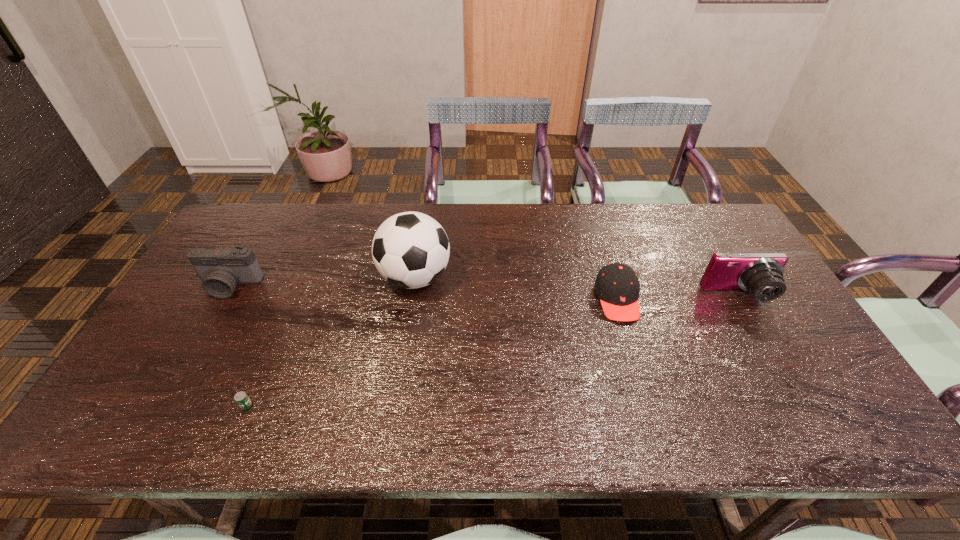
You are a GUI agent. You are given a task and a screenshot of the screen. Output one action in this format:
    pyautogui.click(x=<x>, y=<y>)
    Task: Click on the third object from left to right
    
    Given the screenshot: What is the action you would take?
    pyautogui.click(x=410, y=250)

At what (x,y) coordinates should I click in order to perform the action: click on soccer ball. Please return your answer as a coordinate pair (x, y). The width and height of the screenshot is (960, 540). Looking at the image, I should click on (410, 250).

Where is `the rightmost object`? the rightmost object is located at coordinates (761, 274).

Identify the location of the left camera. (221, 269).

What are the coordinates of `the second shortest object` in the screenshot? It's located at (617, 285).

Locate an element on the screen. the second object from right to left is located at coordinates (617, 285).

Identify the location of the nearest object. This screenshot has width=960, height=540. (241, 398).

At what (x,y) coordinates should I click in order to perform the action: click on beer can. Please return your answer as a coordinate pair (x, y). Looking at the image, I should click on (241, 398).

Where is `vacant space located 0.240m on the right of the third object from right to left`? The image size is (960, 540). vacant space located 0.240m on the right of the third object from right to left is located at coordinates (531, 278).

What are the coordinates of `vacant space positioned 0.230m on the front-facing side of the right camera` in the screenshot? It's located at (786, 380).